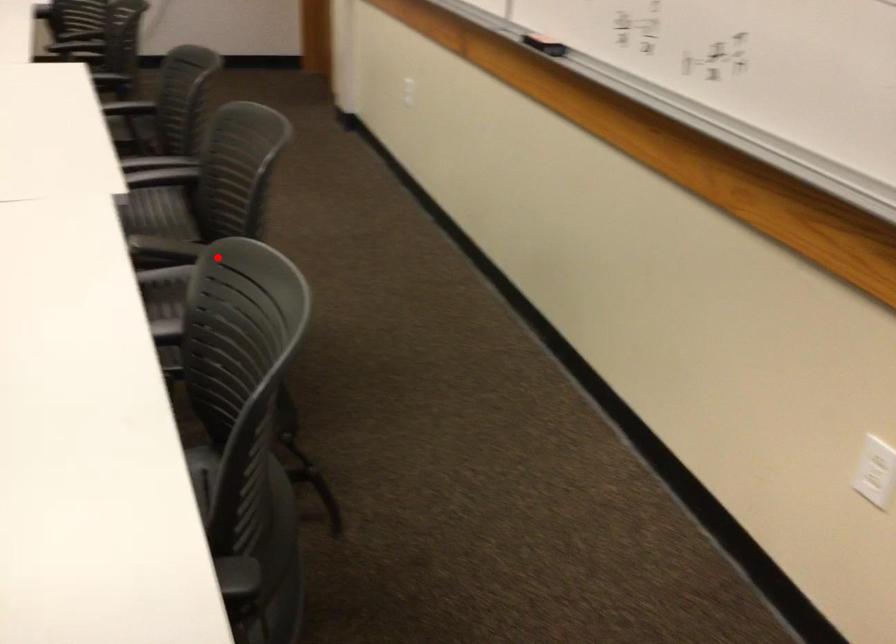
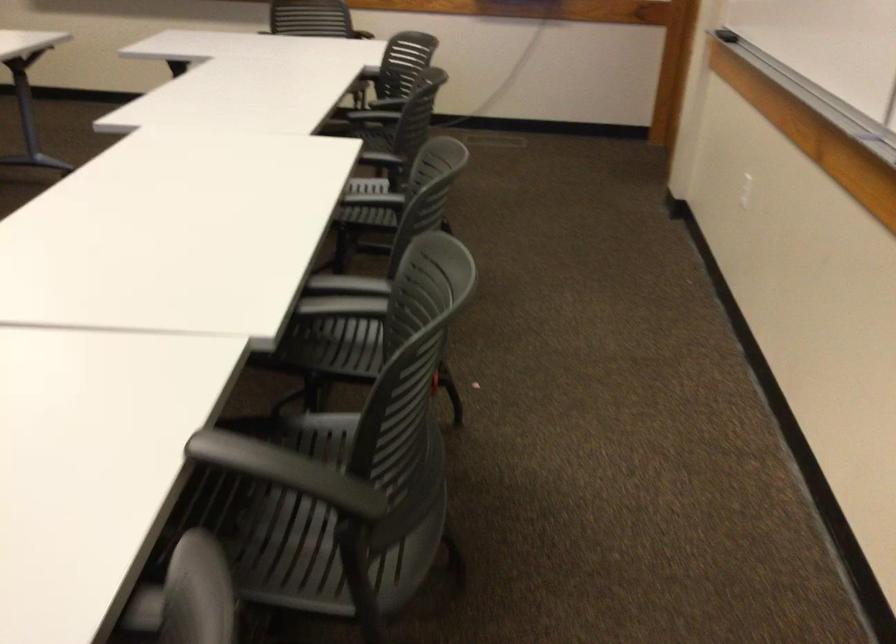
The point at the highlighted location is marked in the first image. Where is the corresponding point in the second image?

(286, 471)